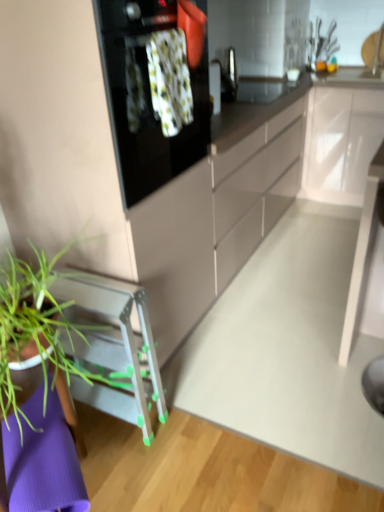
Question: From a real-world perspective, is green plastic stool at lower left below white glossy cabinet at upper right?

Choices:
 (A) no
 (B) yes

Answer: (B)

Question: From a real-world perspective, is green plastic stool at lower left on white glossy cabinet at upper right?

Choices:
 (A) yes
 (B) no

Answer: (B)

Question: Can you confirm if green plastic stool at lower left is wider than white glossy cabinet at upper right?

Choices:
 (A) no
 (B) yes

Answer: (B)

Question: Does green plastic stool at lower left have a lesser width compared to white glossy cabinet at upper right?

Choices:
 (A) no
 (B) yes

Answer: (A)

Question: Is green plastic stool at lower left at the left side of white glossy cabinet at upper right?

Choices:
 (A) yes
 (B) no

Answer: (A)

Question: From the image's perspective, is green plastic stool at lower left located above white glossy cabinet at upper right?

Choices:
 (A) no
 (B) yes

Answer: (A)

Question: Can you confirm if white glossy cabinet at upper right is smaller than black glass oven at upper center?

Choices:
 (A) no
 (B) yes

Answer: (A)

Question: Is white glossy cabinet at upper right at the right side of black glass oven at upper center?

Choices:
 (A) yes
 (B) no

Answer: (A)

Question: Would you say black glass oven at upper center is part of white glossy cabinet at upper right's contents?

Choices:
 (A) yes
 (B) no

Answer: (B)

Question: Is white glossy cabinet at upper right oriented away from black glass oven at upper center?

Choices:
 (A) no
 (B) yes

Answer: (A)

Question: Is white glossy cabinet at upper right to the left of black glass oven at upper center from the viewer's perspective?

Choices:
 (A) no
 (B) yes

Answer: (A)

Question: Is white glossy cabinet at upper right not near black glass oven at upper center?

Choices:
 (A) no
 (B) yes

Answer: (B)

Question: From the image's perspective, would you say white glossy cabinet at upper right is positioned over white glossy table at center?

Choices:
 (A) no
 (B) yes

Answer: (B)